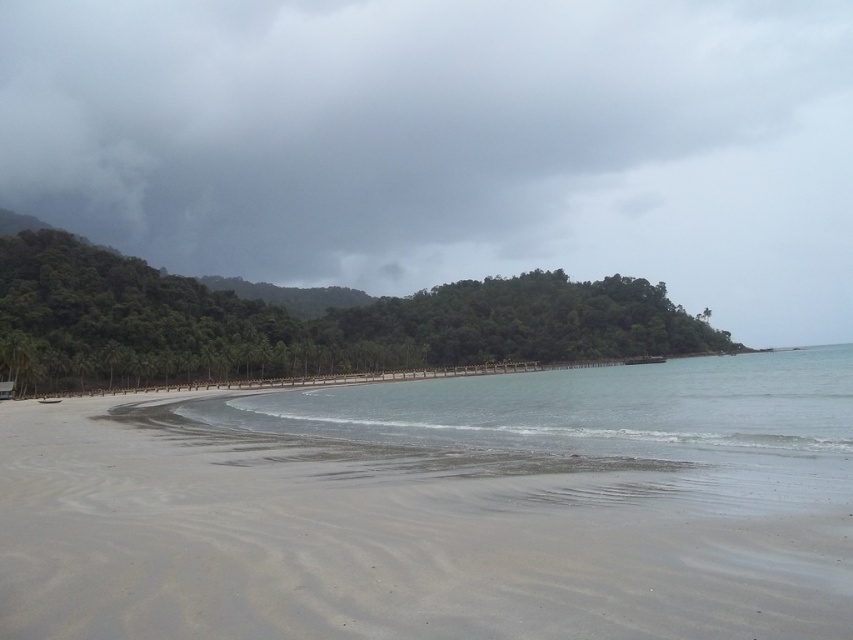
Question: Is gray cloudy sky at upper center further to the viewer compared to green leafy island at center?

Choices:
 (A) no
 (B) yes

Answer: (B)

Question: Can you confirm if gray cloudy sky at upper center is positioned to the right of smooth sand at lower center?

Choices:
 (A) no
 (B) yes

Answer: (B)

Question: Which point is closer to the camera taking this photo?

Choices:
 (A) (514, 508)
 (B) (35, 64)

Answer: (A)

Question: Estimate the real-world distances between objects in this image. Which object is farther from the green leafy island at center?

Choices:
 (A) smooth sand at lower center
 (B) gray cloudy sky at upper center

Answer: (B)

Question: Where is smooth sand at lower center located in relation to green leafy island at center in the image?

Choices:
 (A) right
 (B) left

Answer: (B)

Question: Which of the following is the farthest from the observer?

Choices:
 (A) (827, 58)
 (B) (183, 616)

Answer: (A)